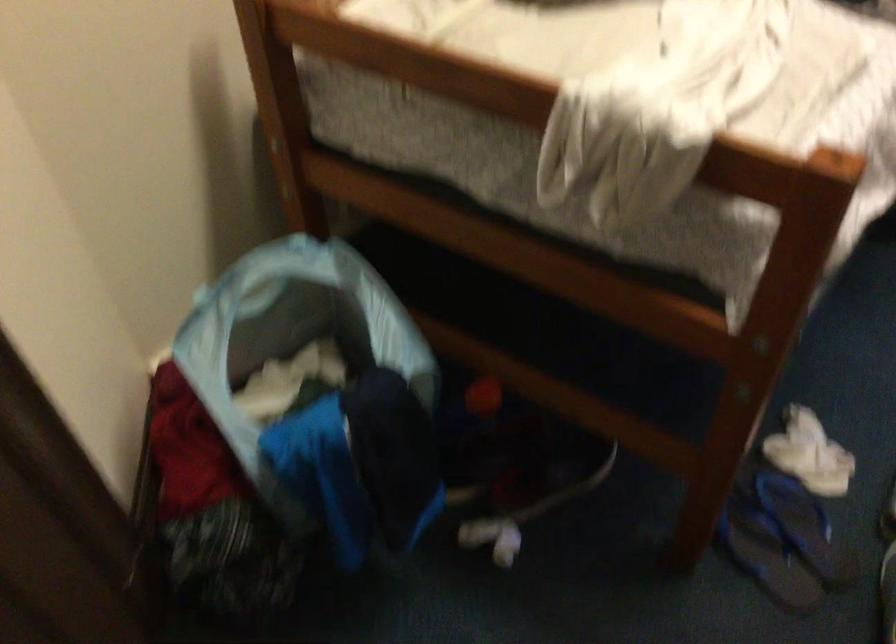
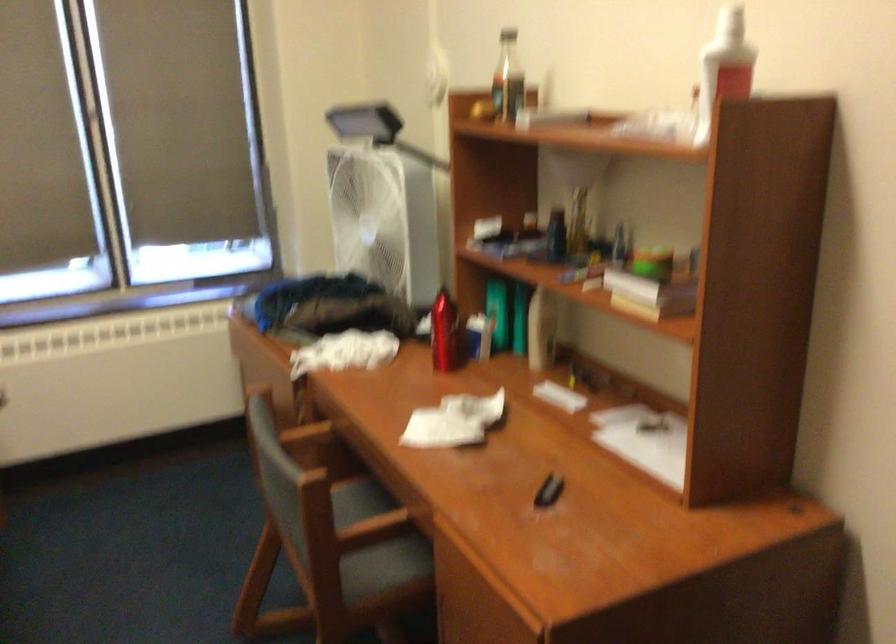
Question: The images are taken continuously from a first-person perspective. In which direction is your viewpoint rotating?

Choices:
 (A) Left
 (B) Right
 (C) Up
 (D) Down

Answer: (B)